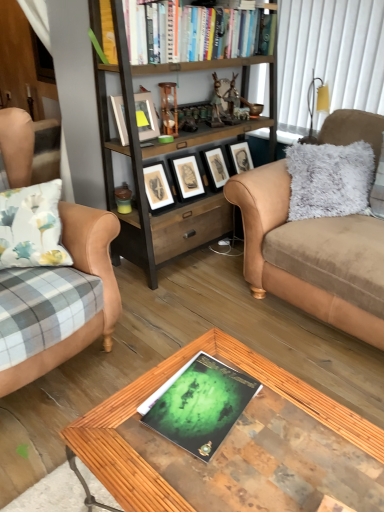
You are a GUI agent. You are given a task and a screenshot of the screen. Output one action in this format:
    pyautogui.click(x=<x>, y=<y>)
    Task: Click on the vacant area that is situated to the right of green matte magazine at center
    The height and width of the screenshot is (512, 384).
    Given the screenshot: What is the action you would take?
    click(305, 430)